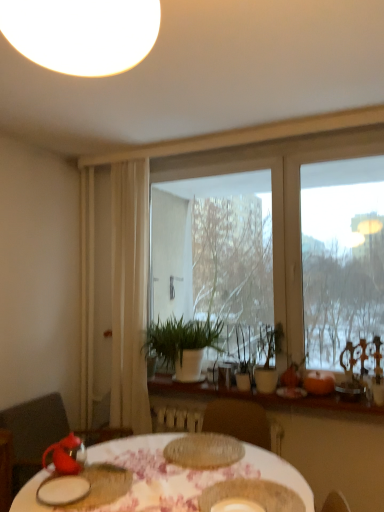
At what (x,y) coordinates should I click in order to perform the action: click on free space to the left of translucent glass plate at center, the 7th tableware in the right-to-left sequence. Please return your answer as a coordinate pair (x, y). Image resolution: width=384 pixels, height=512 pixels. Looking at the image, I should click on (138, 456).